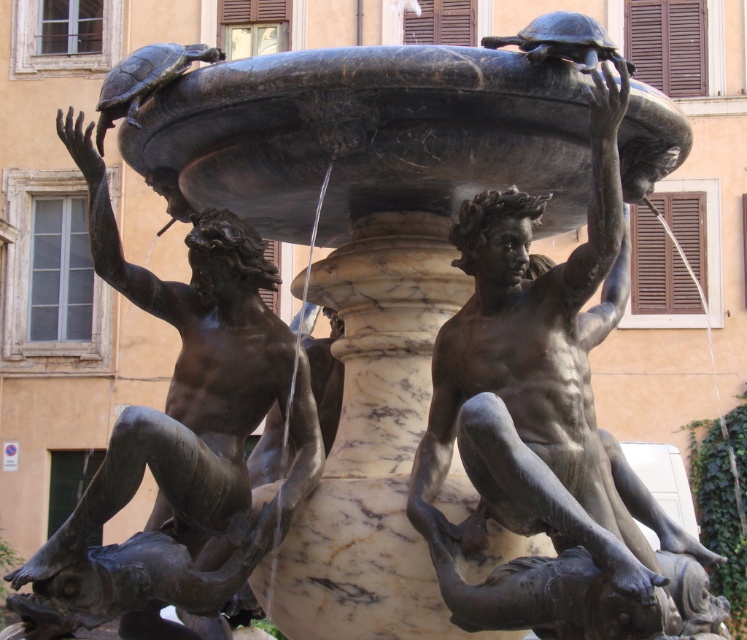
Who is more forward, (524,266) or (120,284)?

Point (524,266) is in front.

Can you confirm if bronze statue at center is smaller than bronze statue at left?

Indeed, bronze statue at center has a smaller size compared to bronze statue at left.

Between point (524, 353) and point (217, 541), which one is positioned in front?

Point (524, 353) is in front.

What are the coordinates of `bronze statue at center` in the screenshot? It's located at (542, 413).